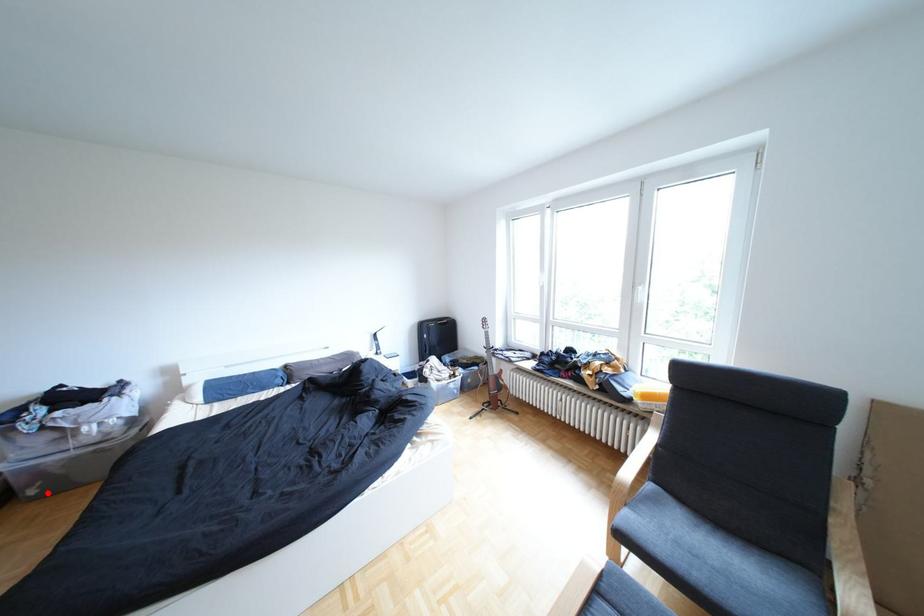
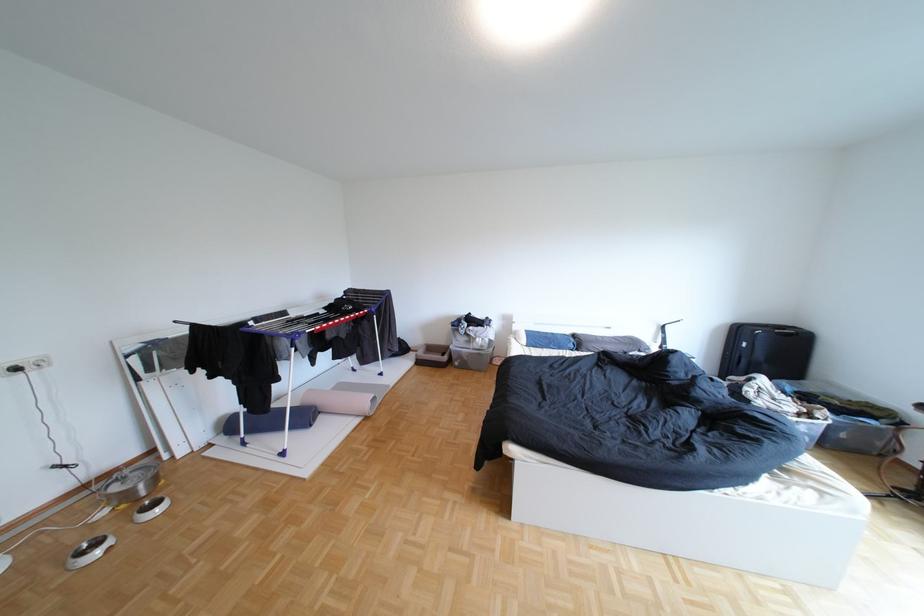
Locate, in the second image, the point that corresponds to the highlighted location in the first image.

(472, 363)